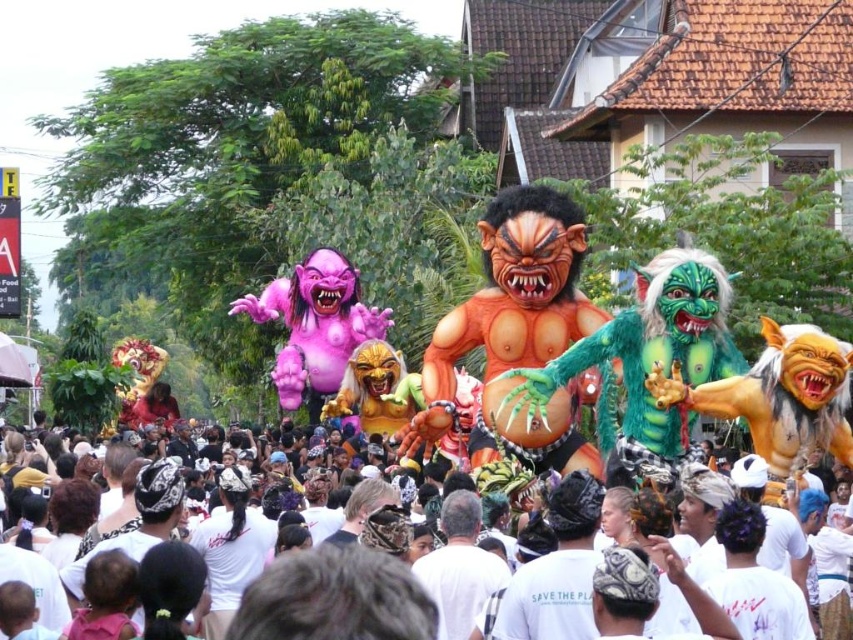
Question: Does multicolored fabric float at center come in front of white cotton crowd at center?

Choices:
 (A) yes
 (B) no

Answer: (A)

Question: Which of the following is the farthest from the observer?

Choices:
 (A) multicolored fabric float at center
 (B) white cotton crowd at center

Answer: (B)

Question: Is multicolored fabric float at center below white cotton crowd at center?

Choices:
 (A) yes
 (B) no

Answer: (B)

Question: Which point appears closest to the camera in this image?

Choices:
 (A) (677, 492)
 (B) (495, 278)

Answer: (A)

Question: Does multicolored fabric float at center appear over white cotton crowd at center?

Choices:
 (A) no
 (B) yes

Answer: (B)